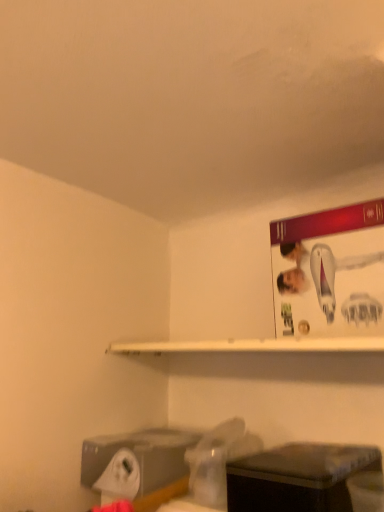
What is the approximate height of white matte shelf at upper center?

The height of white matte shelf at upper center is 0.71 inches.

Locate an element on the screen. The image size is (384, 512). white matte shelf at upper center is located at coordinates (254, 345).

The image size is (384, 512). What do you see at coordinates (254, 345) in the screenshot?
I see `white matte shelf at upper center` at bounding box center [254, 345].

What is the approximate height of black plastic box at lower right?

black plastic box at lower right is 3.18 inches tall.

The image size is (384, 512). What are the coordinates of `black plastic box at lower right` in the screenshot? It's located at (298, 478).

Describe the element at coordinates (298, 478) in the screenshot. I see `black plastic box at lower right` at that location.

The height and width of the screenshot is (512, 384). What are the coordinates of `white matte shelf at upper center` in the screenshot? It's located at (254, 345).

Considering the positions of objects black plastic box at lower right and white matte shelf at upper center in the image provided, who is more to the right, black plastic box at lower right or white matte shelf at upper center?

From the viewer's perspective, black plastic box at lower right appears more on the right side.

Consider the image. Which is behind, black plastic box at lower right or white matte shelf at upper center?

white matte shelf at upper center is further away from the camera.

Which is in front, point (343, 467) or point (198, 342)?

Positioned in front is point (343, 467).

From the image's perspective, does black plastic box at lower right appear higher than white matte shelf at upper center?

No, from the image's perspective, black plastic box at lower right is not above white matte shelf at upper center.

From a real-world perspective, is black plastic box at lower right positioned under white matte shelf at upper center based on gravity?

Yes, from a real-world perspective, black plastic box at lower right is beneath white matte shelf at upper center.

Is black plastic box at lower right thinner than white matte shelf at upper center?

No, black plastic box at lower right is not thinner than white matte shelf at upper center.

Can you confirm if black plastic box at lower right is shorter than white matte shelf at upper center?

In fact, black plastic box at lower right may be taller than white matte shelf at upper center.

Is black plastic box at lower right smaller than white matte shelf at upper center?

No.

Is black plastic box at lower right spatially inside white matte shelf at upper center, or outside of it?

black plastic box at lower right cannot be found inside white matte shelf at upper center.

Are black plastic box at lower right and white matte shelf at upper center beside each other?

black plastic box at lower right and white matte shelf at upper center are clearly separated.

Could you tell me if black plastic box at lower right is turned towards white matte shelf at upper center?

No.

How different are the orientations of black plastic box at lower right and white matte shelf at upper center in degrees?

They differ by 0.912 degrees in their facing directions.

The height and width of the screenshot is (512, 384). Identify the location of shelf behind the black plastic box at lower right. (254, 345).

Which object is positioned more to the right, white matte shelf at upper center or black plastic box at lower right?

From the viewer's perspective, black plastic box at lower right appears more on the right side.

Is white matte shelf at upper center positioned behind black plastic box at lower right?

Yes, the depth of white matte shelf at upper center is greater than that of black plastic box at lower right.

Considering the positions of point (300, 346) and point (302, 496), is point (300, 346) closer or farther from the camera than point (302, 496)?

Point (300, 346) is positioned farther from the camera compared to point (302, 496).

From the image's perspective, is white matte shelf at upper center located beneath black plastic box at lower right?

Actually, white matte shelf at upper center appears above black plastic box at lower right in the image.

From a real-world perspective, is white matte shelf at upper center above or below black plastic box at lower right?

white matte shelf at upper center is situated higher than black plastic box at lower right in the real world.

Considering the sizes of objects white matte shelf at upper center and black plastic box at lower right in the image provided, who is thinner, white matte shelf at upper center or black plastic box at lower right?

With smaller width is white matte shelf at upper center.

Can you confirm if white matte shelf at upper center is shorter than black plastic box at lower right?

Correct, white matte shelf at upper center is not as tall as black plastic box at lower right.

Considering the sizes of objects white matte shelf at upper center and black plastic box at lower right in the image provided, who is smaller, white matte shelf at upper center or black plastic box at lower right?

Smaller between the two is white matte shelf at upper center.

Can black plastic box at lower right be found inside white matte shelf at upper center?

No, black plastic box at lower right is located outside of white matte shelf at upper center.

Are white matte shelf at upper center and black plastic box at lower right far apart?

Actually, white matte shelf at upper center and black plastic box at lower right are a little close together.

Looking at this image, does white matte shelf at upper center turn towards black plastic box at lower right?

No, white matte shelf at upper center is not aimed at black plastic box at lower right.

How different are the orientations of white matte shelf at upper center and black plastic box at lower right in degrees?

white matte shelf at upper center and black plastic box at lower right are facing 0.912 degrees away from each other.

Find the location of a particular element. shelf that is above the black plastic box at lower right (from the image's perspective) is located at coordinates (254, 345).

The width and height of the screenshot is (384, 512). Find the location of `furniture that is under the white matte shelf at upper center (from a real-world perspective)`. furniture that is under the white matte shelf at upper center (from a real-world perspective) is located at coordinates (298, 478).

You are a GUI agent. You are given a task and a screenshot of the screen. Output one action in this format:
    pyautogui.click(x=<x>, y=<y>)
    Task: Click on the shelf on the left of black plastic box at lower right
    
    Given the screenshot: What is the action you would take?
    pyautogui.click(x=254, y=345)